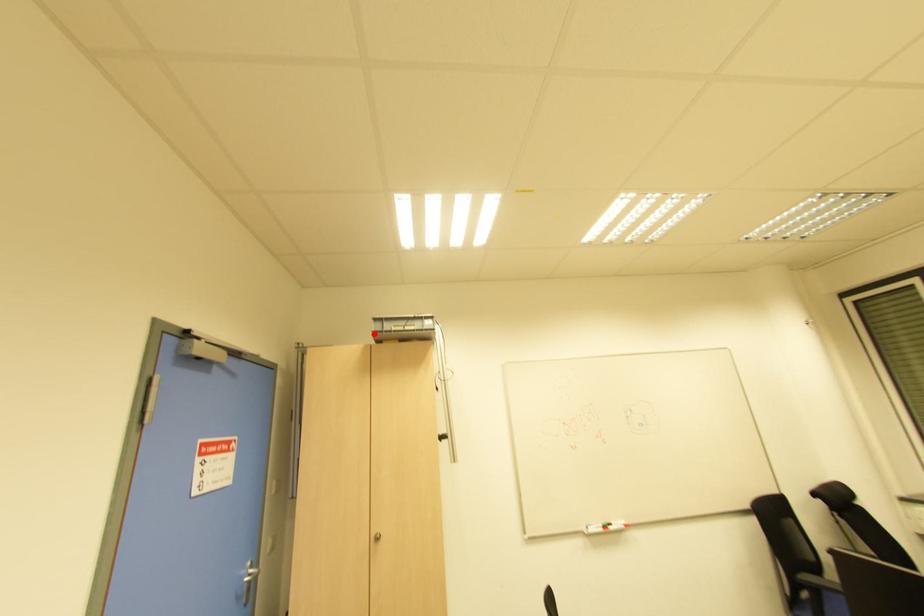
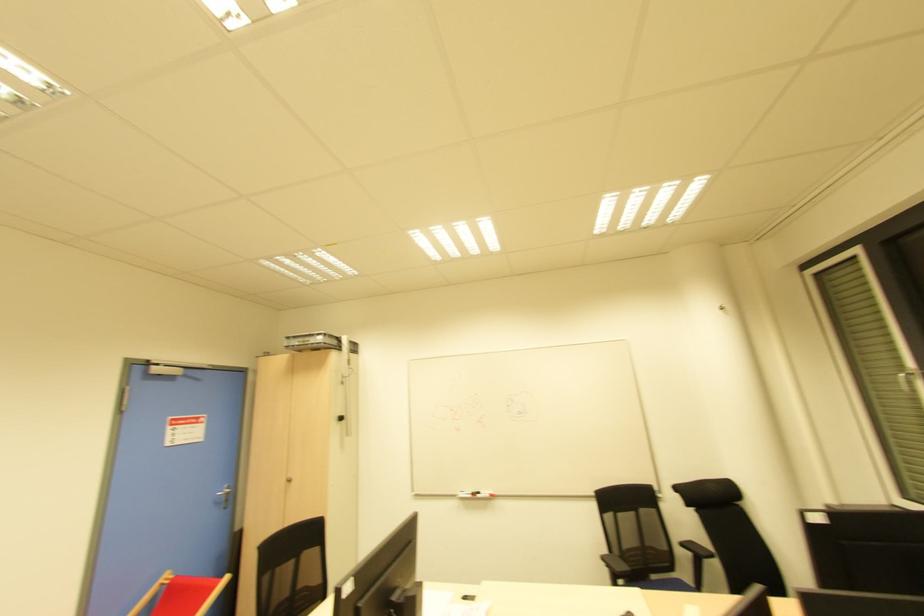
In the second image, find the point that corresponds to the highlighted location in the first image.

(286, 347)